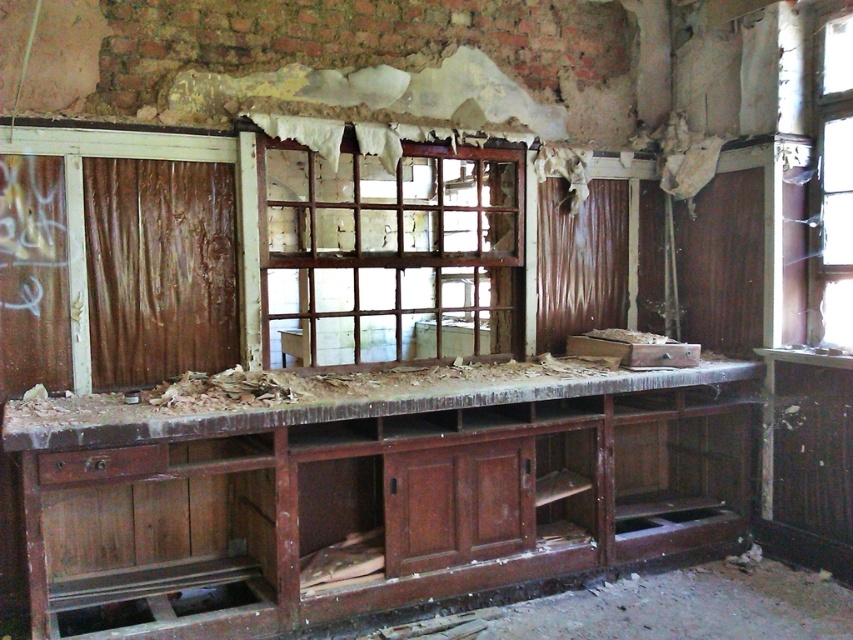
You are standing in the room and looking at two points in the scene. The first point is at coordinates point (416, 449) and the second point is at coordinates point (403, 420). Which of these two points is closer to you?

Point (416, 449) is closer to the camera than point (403, 420).

You are a contractor assessing the damage in this room. You need to move the wooden debris at center to the right side of the room. Which direction should you move the rusty wood workbench at center to avoid blocking the path?

The rusty wood workbench at center is to the left of wooden debris at center. To avoid blocking the path when moving the wooden debris to the right, you should move the rusty wood workbench at center to the left side of the room.

You are standing in the room and want to reach the point marked at coordinates (434, 314). The debris on the floor is scattered in such a way that you can only move in a straight line. Given that the distance from your current position to the point is 14.97 feet, is it possible to reach the point without stepping on any debris?

The distance between you and the point marked at (434, 314) is 14.97 feet. Since the debris is scattered and you can move in a straight line, it is possible to reach the point without stepping on debris, provided you navigate carefully along that path.